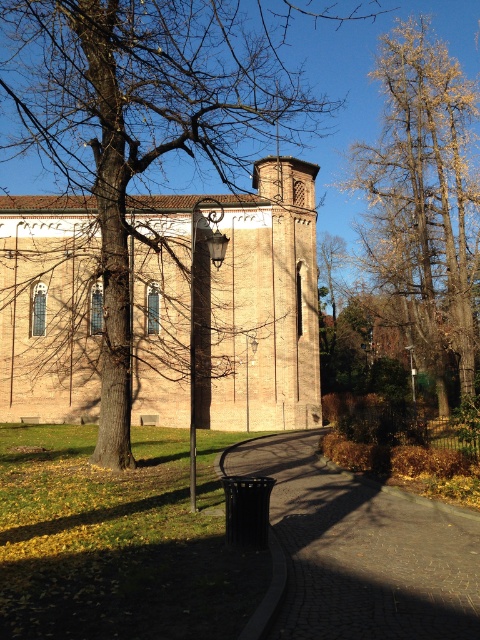
Does brick church at center appear under golden-brown bark tree at upper right?

Indeed, brick church at center is positioned under golden-brown bark tree at upper right.

Consider the image. How distant is brick church at center from golden-brown bark tree at upper right?

brick church at center and golden-brown bark tree at upper right are 32.39 feet apart from each other.

Is point (254, 182) less distant than point (456, 188)?

That is False.

Where is `brick church at center`? This screenshot has width=480, height=640. brick church at center is located at coordinates (260, 305).

Is point (75, 76) positioned behind point (423, 612)?

Yes, it is.

Between brown textured tree at center and brown cobblestone path at lower center, which one appears on the right side from the viewer's perspective?

From the viewer's perspective, brown cobblestone path at lower center appears more on the right side.

Between point (90, 96) and point (387, 634), which one is positioned in front?

Point (387, 634) is in front.

What are the coordinates of `brown textured tree at center` in the screenshot? It's located at (142, 122).

Is brick church at center to the left of brown textured tree at center from the viewer's perspective?

In fact, brick church at center is to the right of brown textured tree at center.

Between brick church at center and brown textured tree at center, which one has more height?

With more height is brown textured tree at center.

Find the location of a particular element. The image size is (480, 640). brick church at center is located at coordinates (260, 305).

Identify the location of brick church at center. This screenshot has width=480, height=640. (260, 305).